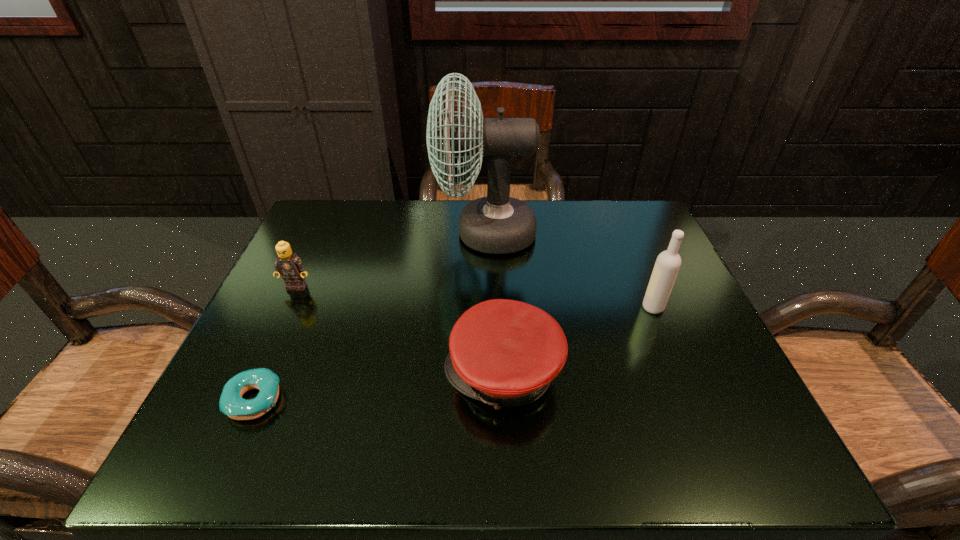
Where is `free space at the far right corner`? Image resolution: width=960 pixels, height=540 pixels. free space at the far right corner is located at coordinates (600, 234).

At what (x,y) coordinates should I click in order to perform the action: click on vacant area between the doughnut and the second shortest object. Please return your answer as a coordinate pair (x, y). Looking at the image, I should click on (379, 387).

Identify the location of vacant area that lies between the Lego and the doughnut. (276, 343).

This screenshot has width=960, height=540. I want to click on vacant area between the third tallest object and the fourth shortest object, so click(475, 297).

At what (x,y) coordinates should I click in order to perform the action: click on free space between the tallest object and the doughnut. Please return your answer as a coordinate pair (x, y). The width and height of the screenshot is (960, 540). Looking at the image, I should click on (371, 316).

The image size is (960, 540). I want to click on free area in between the vodka and the third shortest object, so click(475, 297).

What are the coordinates of `unoccupied position between the farthest object and the doughnut` in the screenshot? It's located at (371, 316).

This screenshot has width=960, height=540. I want to click on free area in between the fan and the vodka, so click(569, 270).

Locate an element on the screen. The width and height of the screenshot is (960, 540). empty location between the second shortest object and the Lego is located at coordinates click(x=399, y=330).

Point out which object is positioned as the fourth nearest to the tallest object. Please provide its 2D coordinates. Your answer should be formatted as a tuple, i.e. [(x, y)], where the tuple contains the x and y coordinates of a point satisfying the conditions above.

[(231, 403)]